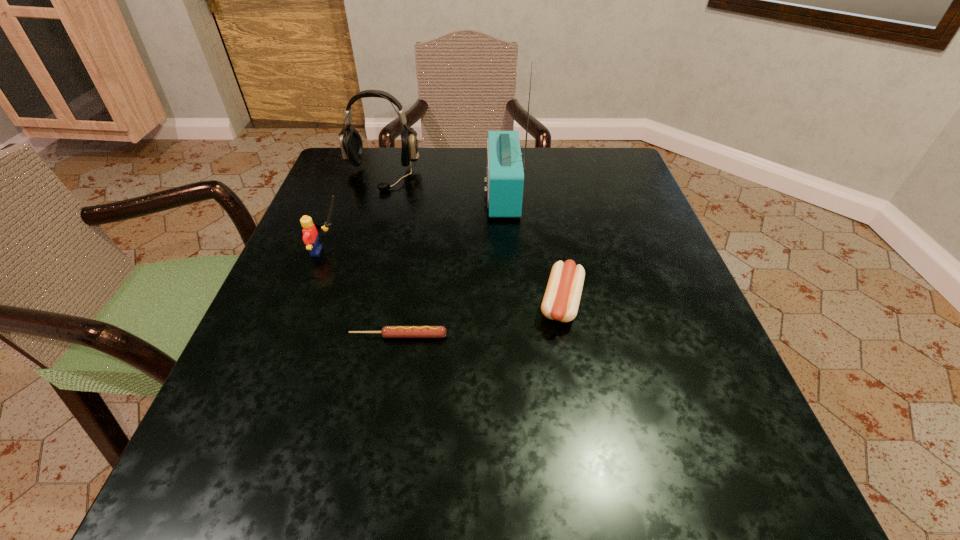
I want to click on empty space that is in between the shortest object and the Lego, so click(x=363, y=294).

This screenshot has height=540, width=960. Find the location of `free point between the second object from right to left and the rightmost object`. free point between the second object from right to left and the rightmost object is located at coordinates (532, 249).

This screenshot has width=960, height=540. I want to click on free space between the taller sausage and the Lego, so click(444, 278).

Find the location of a particular element. vacant space in between the fourth object from left to right and the third tallest object is located at coordinates (416, 223).

You are a GUI agent. You are given a task and a screenshot of the screen. Output one action in this format:
    pyautogui.click(x=<x>, y=<y>)
    Task: Click on the free point between the left sausage and the third shortest object
    
    Given the screenshot: What is the action you would take?
    pyautogui.click(x=363, y=294)

Identify the location of free space that is in between the shortest object and the fourth shortest object. The image size is (960, 540). (390, 255).

The image size is (960, 540). Identify the location of vacant space that is in between the Lego and the headset. (354, 213).

Identify the location of vacant space that's between the left sausage and the headset. (390, 255).

The height and width of the screenshot is (540, 960). Identify the location of object identified as the closest to the third farthest object. (351, 145).

In order to click on object that stands as the second closest to the shorter sausage in this screenshot , I will do `click(310, 237)`.